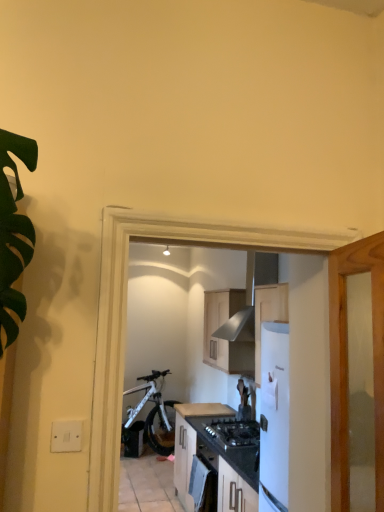
Question: Which direction should I rotate to look at wooden cabinet at center, arranged as the 2th cabinetry when ordered from the bottom, — up or down?

Choices:
 (A) up
 (B) down

Answer: (B)

Question: Can you confirm if black matte gas stove at center is taller than wooden cabinet at center, arranged as the 2th cabinetry when ordered from the bottom?

Choices:
 (A) no
 (B) yes

Answer: (A)

Question: Is wooden cabinet at center, marked as the first cabinetry in a top-to-bottom arrangement, inside black matte gas stove at center?

Choices:
 (A) yes
 (B) no

Answer: (B)

Question: Does black matte gas stove at center touch wooden cabinet at center, arranged as the 2th cabinetry when ordered from the bottom?

Choices:
 (A) yes
 (B) no

Answer: (B)

Question: Is black matte gas stove at center positioned before wooden cabinet at center, arranged as the 2th cabinetry when ordered from the bottom?

Choices:
 (A) no
 (B) yes

Answer: (B)

Question: From the image's perspective, is black matte gas stove at center located beneath wooden cabinet at center, arranged as the 2th cabinetry when ordered from the bottom?

Choices:
 (A) no
 (B) yes

Answer: (B)

Question: Does black matte gas stove at center have a lesser height compared to wooden cabinet at center, marked as the first cabinetry in a top-to-bottom arrangement?

Choices:
 (A) no
 (B) yes

Answer: (B)

Question: Is matte brown countertop at center not close to white matte bicycle at center?

Choices:
 (A) no
 (B) yes

Answer: (B)

Question: Considering the relative positions of matte brown countertop at center and white matte bicycle at center in the image provided, is matte brown countertop at center to the right of white matte bicycle at center from the viewer's perspective?

Choices:
 (A) yes
 (B) no

Answer: (A)

Question: From a real-world perspective, is matte brown countertop at center below white matte bicycle at center?

Choices:
 (A) no
 (B) yes

Answer: (A)

Question: From the image's perspective, is matte brown countertop at center over white matte bicycle at center?

Choices:
 (A) yes
 (B) no

Answer: (A)

Question: Is matte brown countertop at center completely or partially outside of white matte bicycle at center?

Choices:
 (A) yes
 (B) no

Answer: (A)

Question: Can you confirm if matte brown countertop at center is positioned to the left of white matte bicycle at center?

Choices:
 (A) yes
 (B) no

Answer: (B)

Question: Is white matte cabinet at center, the first cabinetry in the bottom-to-top sequence, looking in the opposite direction of white matte bicycle at center?

Choices:
 (A) yes
 (B) no

Answer: (B)